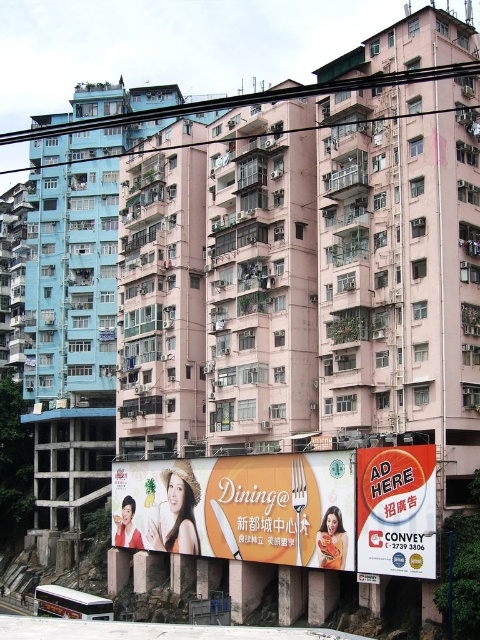
Question: Which point is farther to the camera?

Choices:
 (A) orange glossy billboard at center
 (B) orange glossy billboard at lower center

Answer: (B)

Question: Is orange glossy billboard at lower center further to camera compared to orange glossy billboard at center?

Choices:
 (A) no
 (B) yes

Answer: (B)

Question: From the image, what is the correct spatial relationship of orange glossy billboard at lower center in relation to orange glossy billboard at center?

Choices:
 (A) right
 (B) left

Answer: (B)

Question: Is orange glossy billboard at lower center to the right of orange glossy billboard at center from the viewer's perspective?

Choices:
 (A) no
 (B) yes

Answer: (A)

Question: Among these objects, which one is nearest to the camera?

Choices:
 (A) orange glossy billboard at lower center
 (B) orange glossy billboard at center

Answer: (B)